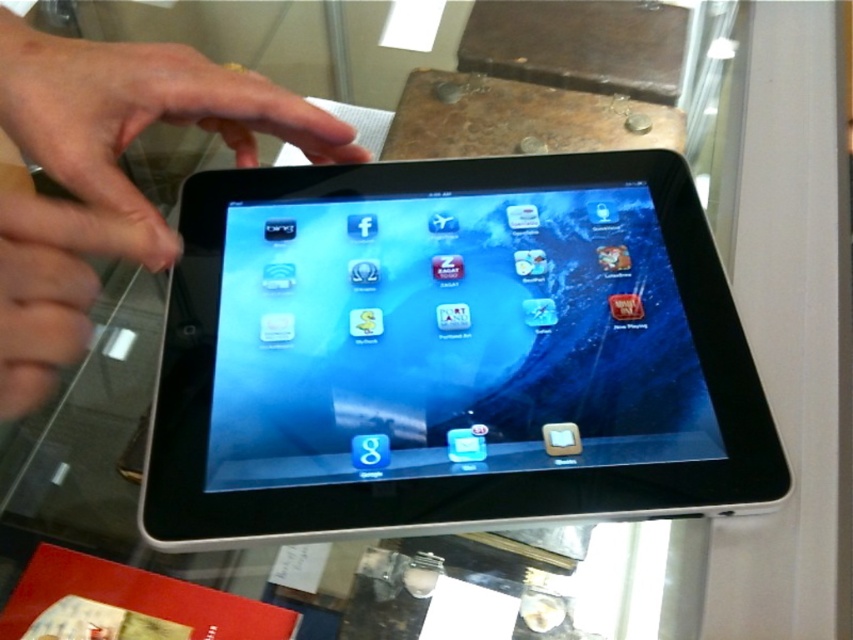
Which is more to the left, black glossy tablet at center or matte black tablet at center?

matte black tablet at center

Is black glossy tablet at center smaller than matte black tablet at center?

Incorrect, black glossy tablet at center is not smaller in size than matte black tablet at center.

Does point (448, 218) come in front of point (3, 392)?

That is False.

You are a GUI agent. You are given a task and a screenshot of the screen. Output one action in this format:
    pyautogui.click(x=<x>, y=<y>)
    Task: Click on the black glossy tablet at center
    The height and width of the screenshot is (640, 853).
    Given the screenshot: What is the action you would take?
    pyautogui.click(x=450, y=352)